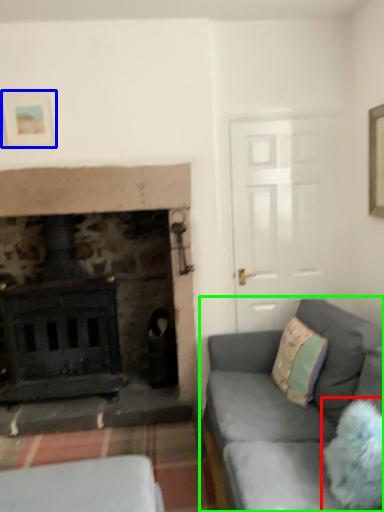
Question: Which is farther away from pillow (highlighted by a red box)? picture frame (highlighted by a blue box) or studio couch (highlighted by a green box)?

Choices:
 (A) picture frame
 (B) studio couch

Answer: (A)